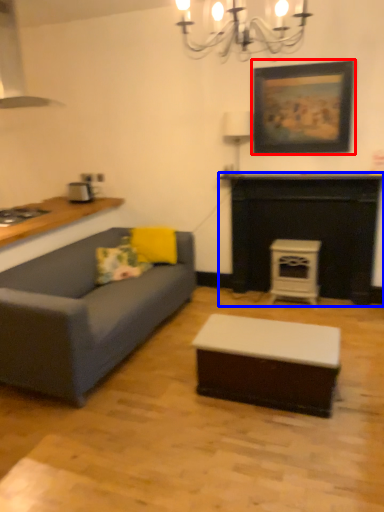
Question: Which object is further to the camera taking this photo, picture frame (highlighted by a red box) or fireplace (highlighted by a blue box)?

Choices:
 (A) picture frame
 (B) fireplace

Answer: (B)